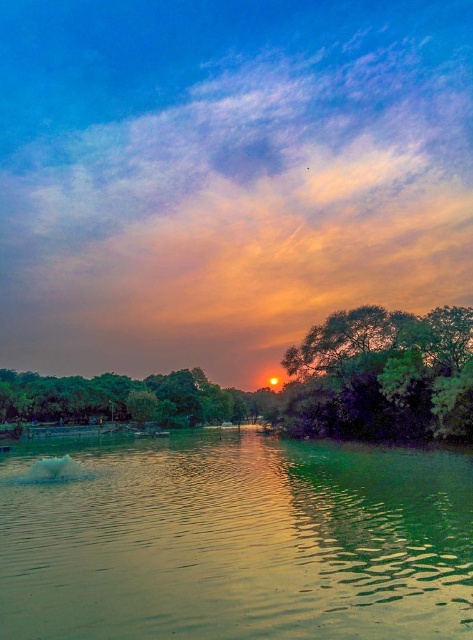
You are a photographer planning to capture the sunset reflection on the green smooth water at center and the green leafy tree at center. Which object appears wider in the image?

The green smooth water at center appears wider than the green leafy tree at center.

You are standing at the point with coordinates point (25, 458) and want to look at the sunset. Is there any object blocking your view of the sunset at point (408, 384)?

Point (25, 458) is behind point (408, 384), so yes, the point (408, 384) is blocking your view of the sunset at point (408, 384).

You are an observer standing at the edge of the water. You see the green smooth water at center and the green leafy trees at center. Which object is closer to your viewpoint?

The green smooth water at center is closer to your viewpoint because it is positioned above the green leafy trees at center, indicating it is nearer in the visual hierarchy.